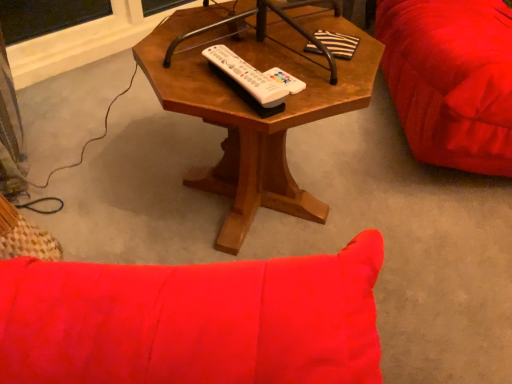
This screenshot has height=384, width=512. In order to click on white plastic remote at center in this screenshot , I will do `click(251, 77)`.

Describe the element at coordinates (251, 77) in the screenshot. The image size is (512, 384). I see `white plastic remote at center` at that location.

Measure the distance between wooden hexagonal table at center and camera.

wooden hexagonal table at center and camera are 28.07 inches apart from each other.

At what (x,y) coordinates should I click in order to perform the action: click on wooden hexagonal table at center. Please return your answer as a coordinate pair (x, y). This screenshot has width=512, height=384. Looking at the image, I should click on (254, 112).

The width and height of the screenshot is (512, 384). What do you see at coordinates (254, 112) in the screenshot?
I see `wooden hexagonal table at center` at bounding box center [254, 112].

Find the location of a particular element. white plastic remote at center is located at coordinates (251, 77).

Considering the relative positions of white plastic remote at center and wooden hexagonal table at center in the image provided, is white plastic remote at center to the left or to the right of wooden hexagonal table at center?

white plastic remote at center is to the left of wooden hexagonal table at center.

Who is more distant, white plastic remote at center or wooden hexagonal table at center?

white plastic remote at center is behind.

Is point (277, 86) closer or farther from the camera than point (153, 40)?

Point (277, 86).

From the image's perspective, relative to wooden hexagonal table at center, is white plastic remote at center above or below?

Clearly, from the image's perspective, white plastic remote at center is above wooden hexagonal table at center.

From a real-world perspective, is white plastic remote at center on wooden hexagonal table at center?

Yes.

From the picture: Which of these two, white plastic remote at center or wooden hexagonal table at center, is thinner?

Thinner between the two is white plastic remote at center.

Is white plastic remote at center taller than wooden hexagonal table at center?

No, white plastic remote at center is not taller than wooden hexagonal table at center.

Can you confirm if white plastic remote at center is bigger than wooden hexagonal table at center?

Actually, white plastic remote at center might be smaller than wooden hexagonal table at center.

Is white plastic remote at center outside of wooden hexagonal table at center?

No, white plastic remote at center is not entirely external to wooden hexagonal table at center.

Are white plastic remote at center and wooden hexagonal table at center making contact?

There is a gap between white plastic remote at center and wooden hexagonal table at center.

Is wooden hexagonal table at center at the back of white plastic remote at center?

Yes.

How different are the orientations of white plastic remote at center and wooden hexagonal table at center in degrees?

There is a 55.3-degree angle between the facing directions of white plastic remote at center and wooden hexagonal table at center.

Where is `coffee table in front of the white plastic remote at center`? The height and width of the screenshot is (384, 512). coffee table in front of the white plastic remote at center is located at coordinates (254, 112).

Between wooden hexagonal table at center and white plastic remote at center, which one appears on the left side from the viewer's perspective?

From the viewer's perspective, white plastic remote at center appears more on the left side.

Is the position of wooden hexagonal table at center less distant than that of white plastic remote at center?

Yes, it is in front of white plastic remote at center.

Considering the points (286, 209) and (271, 77), which point is in front, point (286, 209) or point (271, 77)?

The point (271, 77) is closer to the camera.

From the image's perspective, does wooden hexagonal table at center appear higher than white plastic remote at center?

No, from the image's perspective, wooden hexagonal table at center is not over white plastic remote at center.

From a real-world perspective, is wooden hexagonal table at center positioned above or below white plastic remote at center?

In terms of real-world spatial position, wooden hexagonal table at center is below white plastic remote at center.

Can you confirm if wooden hexagonal table at center is thinner than white plastic remote at center?

Incorrect, the width of wooden hexagonal table at center is not less than that of white plastic remote at center.

Who is shorter, wooden hexagonal table at center or white plastic remote at center?

Standing shorter between the two is white plastic remote at center.

Can you confirm if wooden hexagonal table at center is bigger than white plastic remote at center?

Indeed, wooden hexagonal table at center has a larger size compared to white plastic remote at center.

Would you say wooden hexagonal table at center contains white plastic remote at center?

Yes, white plastic remote at center is a part of wooden hexagonal table at center.

Is wooden hexagonal table at center far from white plastic remote at center?

That's not correct — wooden hexagonal table at center is a little close to white plastic remote at center.

Is wooden hexagonal table at center facing away from white plastic remote at center?

No, wooden hexagonal table at center is not facing the opposite direction of white plastic remote at center.

How different are the orientations of wooden hexagonal table at center and white plastic remote at center in degrees?

wooden hexagonal table at center and white plastic remote at center are facing 55.3 degrees away from each other.

What are the coordinates of `coffee table located underneath the white plastic remote at center (from a real-world perspective)` in the screenshot? It's located at (254, 112).

Identify the location of coffee table on the right of white plastic remote at center. (254, 112).

This screenshot has width=512, height=384. In order to click on remote above the wooden hexagonal table at center (from the image's perspective) in this screenshot , I will do `click(251, 77)`.